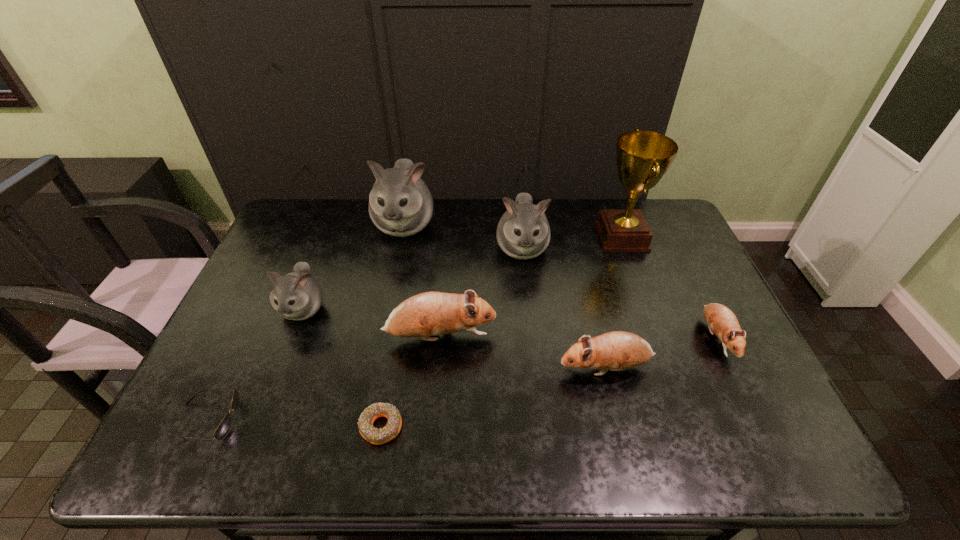
In order to click on vacant space that satisfies the following two spatial constraints: 1. on the face of the second white hamster from left to right; 2. on the front-facing side of the sunglasses in this screenshot , I will do `click(365, 419)`.

Identify the location of free space that satisfies the following two spatial constraints: 1. on the plaque of the award; 2. on the face of the rightmost white hamster. (626, 248).

The image size is (960, 540). Find the location of `vacant region that satisfies the following two spatial constraints: 1. on the face of the second biggest white hamster; 2. at the face of the leftmost brown hamster`. vacant region that satisfies the following two spatial constraints: 1. on the face of the second biggest white hamster; 2. at the face of the leftmost brown hamster is located at coordinates (531, 337).

This screenshot has height=540, width=960. Find the location of `vacant space that satisfies the following two spatial constraints: 1. at the face of the second brown hamster from left to right; 2. on the front side of the doughnut`. vacant space that satisfies the following two spatial constraints: 1. at the face of the second brown hamster from left to right; 2. on the front side of the doughnut is located at coordinates (619, 427).